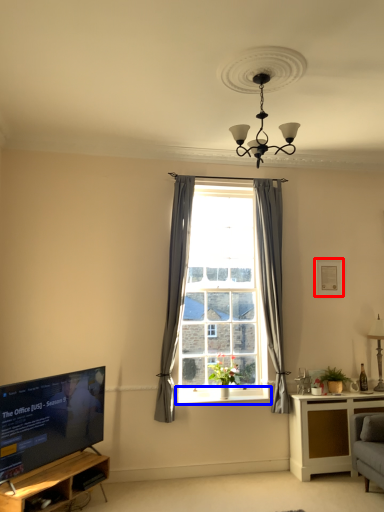
Question: Which object appears closest to the camera in this image, picture frame (highlighted by a red box) or window sill (highlighted by a blue box)?

Choices:
 (A) picture frame
 (B) window sill

Answer: (B)